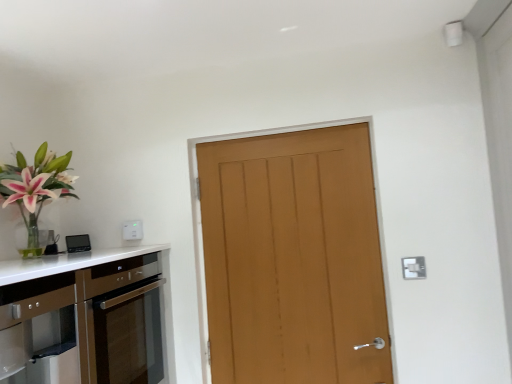
Question: From a real-world perspective, does white plastic electric outlet at upper center, the 2th electric outlet positioned from the right, sit lower than satin brown cabinetry at lower left?

Choices:
 (A) no
 (B) yes

Answer: (A)

Question: Considering the relative positions of white plastic electric outlet at upper center, the second electric outlet positioned from the bottom, and satin brown cabinetry at lower left in the image provided, is white plastic electric outlet at upper center, the second electric outlet positioned from the bottom, in front of satin brown cabinetry at lower left?

Choices:
 (A) yes
 (B) no

Answer: (B)

Question: Is satin brown cabinetry at lower left surrounded by white plastic electric outlet at upper center, the second electric outlet positioned from the bottom?

Choices:
 (A) yes
 (B) no

Answer: (B)

Question: Is satin brown cabinetry at lower left at the back of white plastic electric outlet at upper center, arranged as the 1th electric outlet when viewed from the back?

Choices:
 (A) yes
 (B) no

Answer: (B)

Question: Does white plastic electric outlet at upper center, marked as the 1th electric outlet in a left-to-right arrangement, appear on the left side of satin brown cabinetry at lower left?

Choices:
 (A) yes
 (B) no

Answer: (B)

Question: Considering the positions of white plastic electric outlet at upper center, arranged as the 1th electric outlet when viewed from the back, and satin brown cabinetry at lower left in the image, is white plastic electric outlet at upper center, arranged as the 1th electric outlet when viewed from the back, taller or shorter than satin brown cabinetry at lower left?

Choices:
 (A) short
 (B) tall

Answer: (A)

Question: Choose the correct answer: Is white plastic electric outlet at upper center, which appears as the first electric outlet when viewed from the top, inside satin brown cabinetry at lower left or outside it?

Choices:
 (A) outside
 (B) inside

Answer: (A)

Question: Considering their positions, is white plastic electric outlet at upper center, arranged as the 1th electric outlet when viewed from the back, located in front of or behind satin brown cabinetry at lower left?

Choices:
 (A) behind
 (B) front

Answer: (A)

Question: From a real-world perspective, relative to satin brown cabinetry at lower left, is white plastic electric outlet at upper center, the 2th electric outlet positioned from the right, vertically above or below?

Choices:
 (A) below
 (B) above

Answer: (B)

Question: Looking at the image, does white plastic electric outlet at upper right, which ranks as the first electric outlet in right-to-left order, seem bigger or smaller compared to satin brown cabinetry at lower left?

Choices:
 (A) big
 (B) small

Answer: (B)

Question: From a real-world perspective, relative to satin brown cabinetry at lower left, is white plastic electric outlet at upper right, positioned as the first electric outlet in front-to-back order, vertically above or below?

Choices:
 (A) below
 (B) above

Answer: (B)

Question: From their relative heights in the image, would you say white plastic electric outlet at upper right, which appears as the second electric outlet when viewed from the left, is taller or shorter than satin brown cabinetry at lower left?

Choices:
 (A) tall
 (B) short

Answer: (B)

Question: Is white plastic electric outlet at upper right, which ranks as the first electric outlet in right-to-left order, spatially inside satin brown cabinetry at lower left, or outside of it?

Choices:
 (A) inside
 (B) outside

Answer: (B)

Question: Looking at their shapes, would you say white plastic electric outlet at upper center, the 2th electric outlet viewed from the front, is wider or thinner than white plastic electric outlet at upper right, which ranks as the first electric outlet in right-to-left order?

Choices:
 (A) wide
 (B) thin

Answer: (A)

Question: From a real-world perspective, is white plastic electric outlet at upper center, the 2th electric outlet positioned from the right, physically located above or below white plastic electric outlet at upper right, which is the second electric outlet from back to front?

Choices:
 (A) above
 (B) below

Answer: (A)